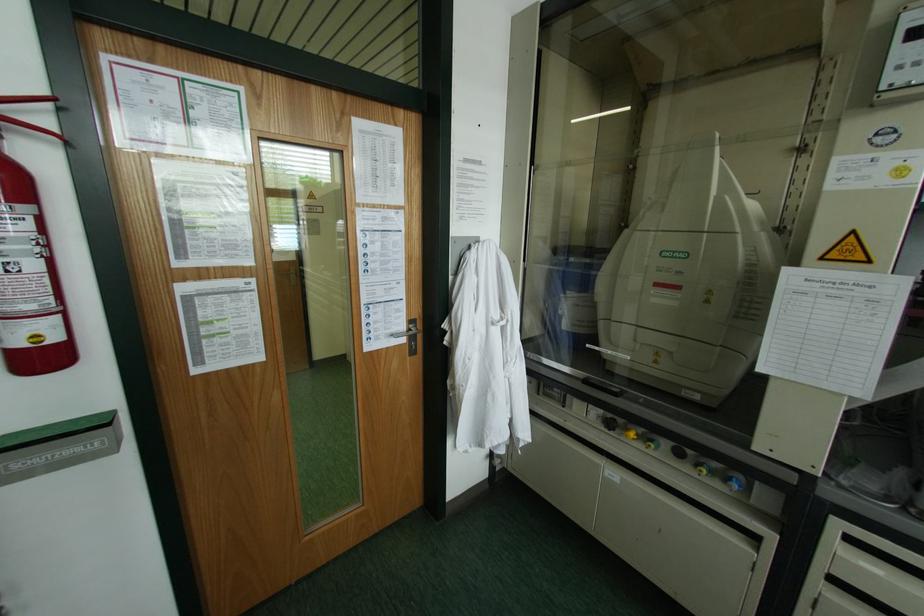
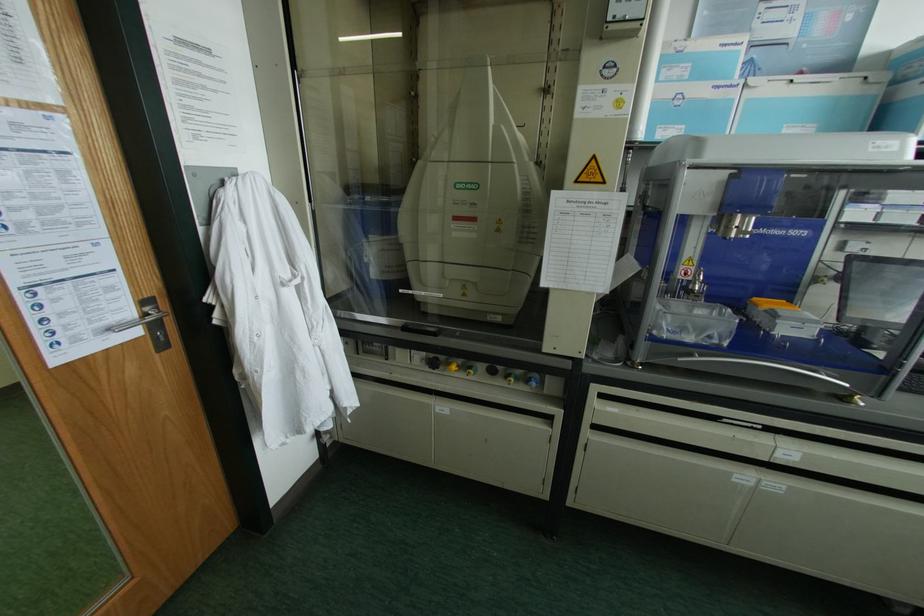
Find the pixel in the second image that matches the point at 657,284 in the first image.

(455, 217)